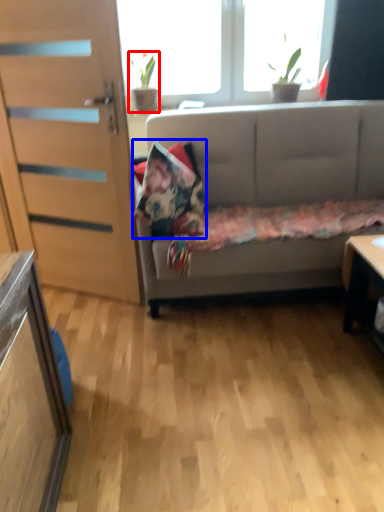
Question: Which object is closer to the camera taking this photo, houseplant (highlighted by a red box) or pillow (highlighted by a blue box)?

Choices:
 (A) houseplant
 (B) pillow

Answer: (B)